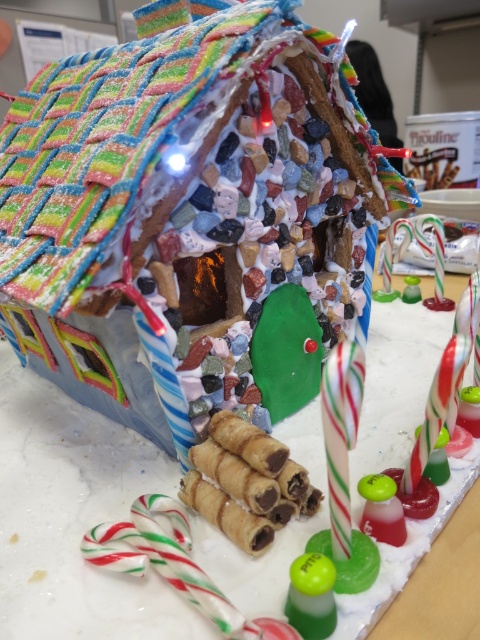
How far apart are candy-coated gingerbread house at center and striped candy cane at center?

candy-coated gingerbread house at center is 13.68 inches from striped candy cane at center.

Between candy-coated gingerbread house at center and striped candy cane at center, which one appears on the right side from the viewer's perspective?

From the viewer's perspective, striped candy cane at center appears more on the right side.

Where is `candy-coated gingerbread house at center`? candy-coated gingerbread house at center is located at coordinates (192, 214).